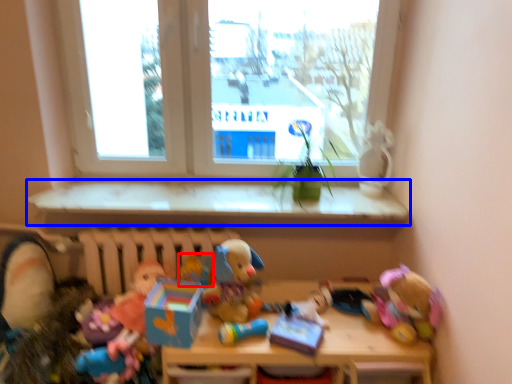
Question: Which of the following is the closest to the observer, toy (highlighted by a red box) or window sill (highlighted by a blue box)?

Choices:
 (A) toy
 (B) window sill

Answer: (A)